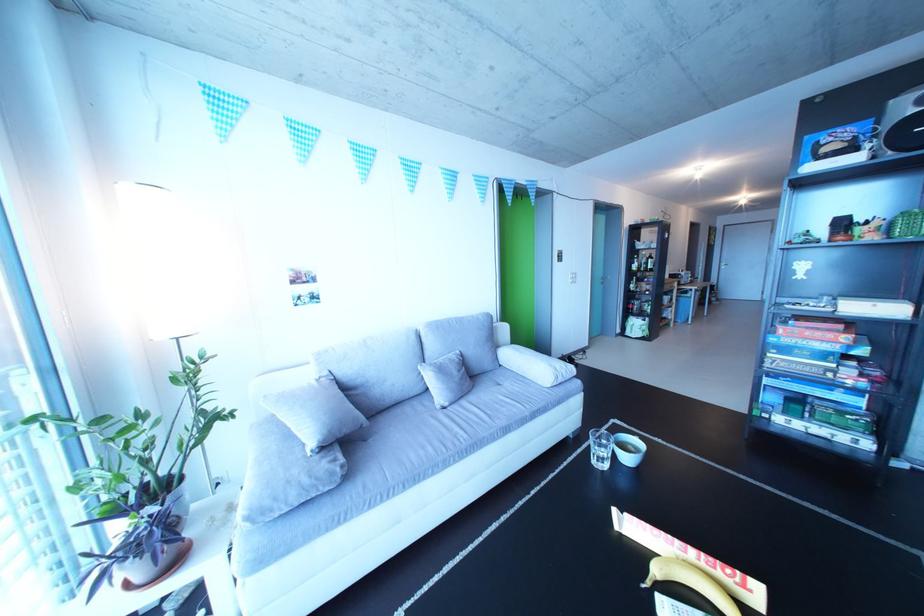
Find where to peel the yellow banana. Please return your answer as a coordinate pair (x, y).

(690, 582)